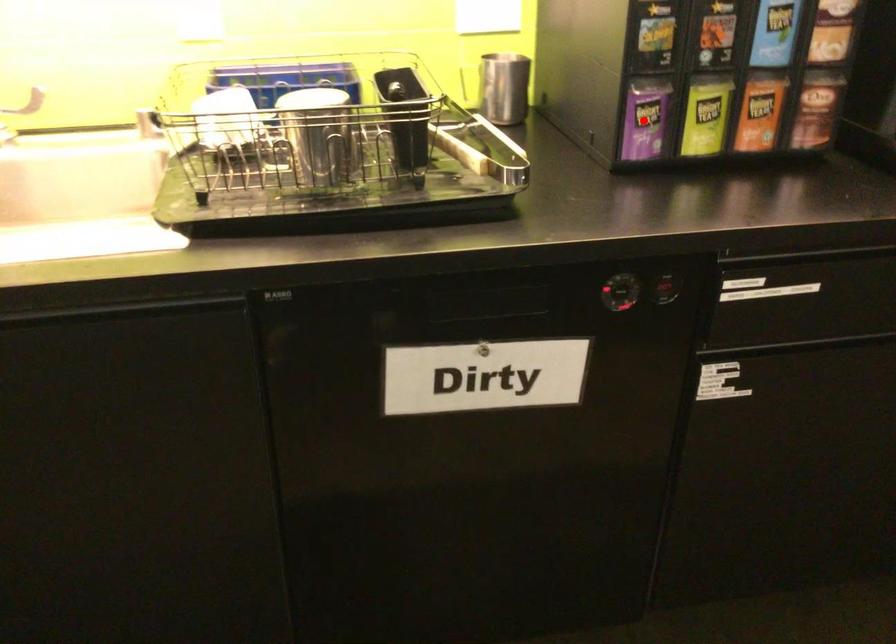
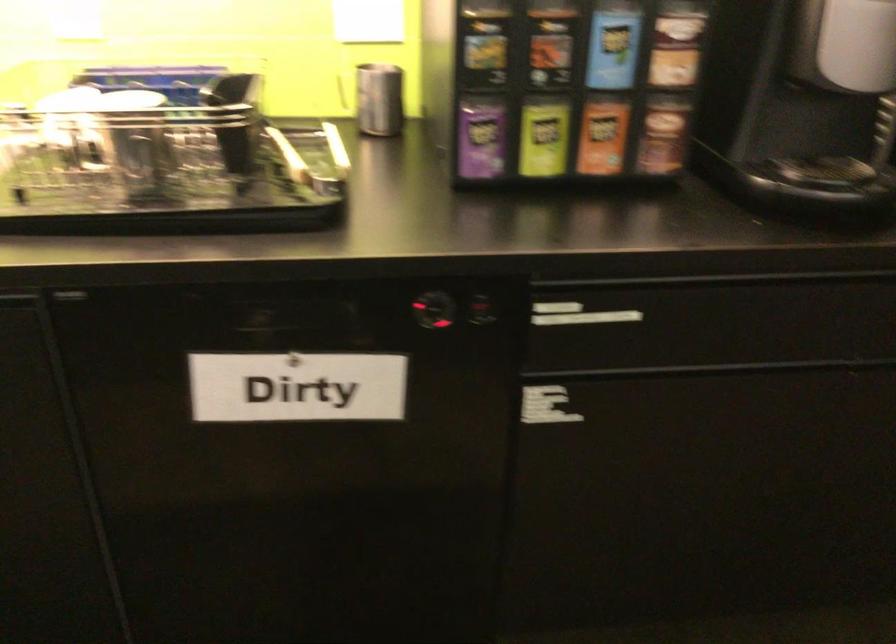
Where in the second image is the point corresponding to the highlighted location from the first image?

(479, 138)